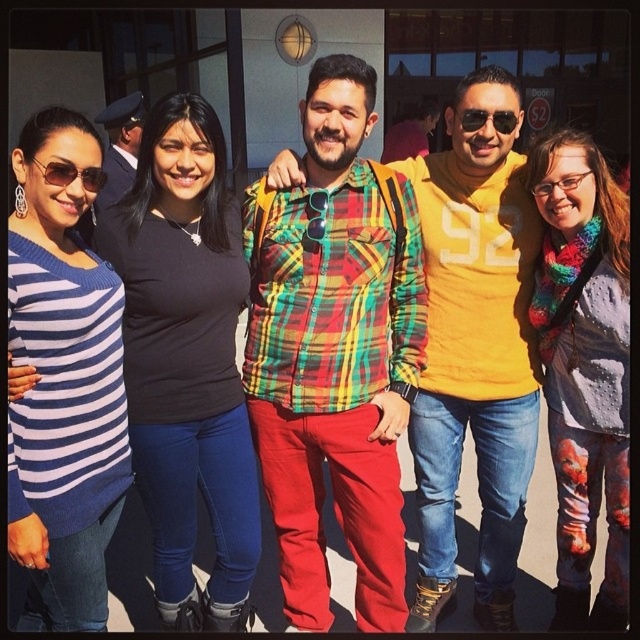
You are a photographer trying to capture a closeup of the black matte shirt at center without including the sunglasses at left in the frame. Based on their relative heights, is this possible?

The black matte shirt at center has a greater height compared to sunglasses at left, so it is possible to capture a closeup of the black matte shirt at center without including the sunglasses at left in the frame since it is taller.

From the picture: You are a photographer trying to adjust your camera focus. You have two points in the image you need to focus on, point (170, 573) and point (49, 170). Which point is closer to you and should be focused on first?

Point (170, 573) is closer to the viewer than point (49, 170), so you should focus on point (170, 573) first.

You are a photographer trying to adjust the focus on your camera. You want to ensure that both the blue and white striped sweater at left and the knitted scarf at center are clearly visible. Which object should you focus on first to ensure proper depth of field?

The blue and white striped sweater at left has a lesser height compared to knitted scarf at center, so you should focus on the knitted scarf at center first to ensure proper depth of field.